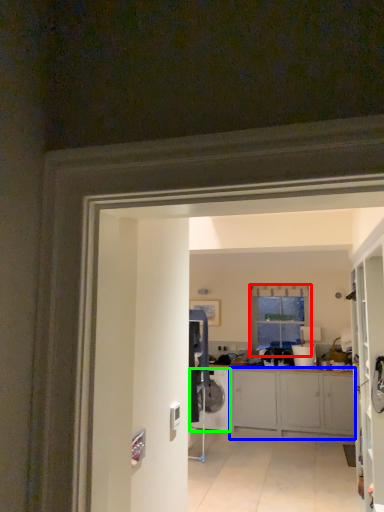
Question: Which object is the farthest from window (highlighted by a red box)? Choose among these: cabinetry (highlighted by a blue box) or washing machine (highlighted by a green box).

Choices:
 (A) cabinetry
 (B) washing machine

Answer: (B)